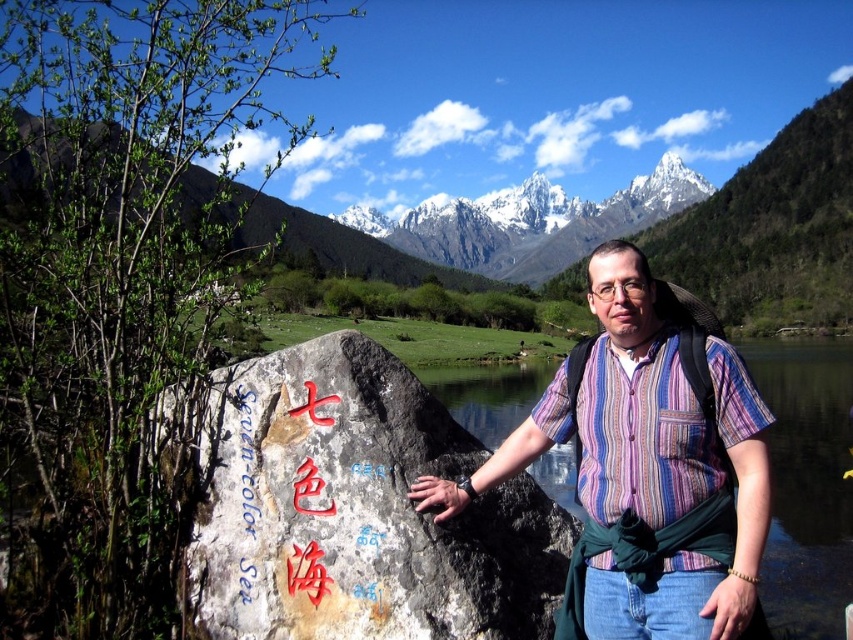
Which of these two, rusty stone boulder at center or bluetexturedwriting at center, stands shorter?

bluetexturedwriting at center is shorter.

Is rusty stone boulder at center further to the viewer compared to bluetexturedwriting at center?

That is False.

Is point (230, 504) positioned in front of point (247, 401)?

Yes.

Where is `rusty stone boulder at center`? This screenshot has height=640, width=853. rusty stone boulder at center is located at coordinates (361, 509).

Consider the image. Is striped cotton shirt at center further to the viewer compared to bluetexturedwriting at center?

Yes.

From the picture: Is striped cotton shirt at center in front of bluetexturedwriting at center?

No, striped cotton shirt at center is behind bluetexturedwriting at center.

Image resolution: width=853 pixels, height=640 pixels. Find the location of `striped cotton shirt at center`. striped cotton shirt at center is located at coordinates (643, 436).

This screenshot has height=640, width=853. What do you see at coordinates (613, 412) in the screenshot?
I see `striped fabric shirt at center` at bounding box center [613, 412].

Is point (627, 422) positioned before point (601, 477)?

That is True.

Does point (602, 301) come behind point (732, 364)?

Yes.

This screenshot has width=853, height=640. Identify the location of striped fabric shirt at center. (613, 412).